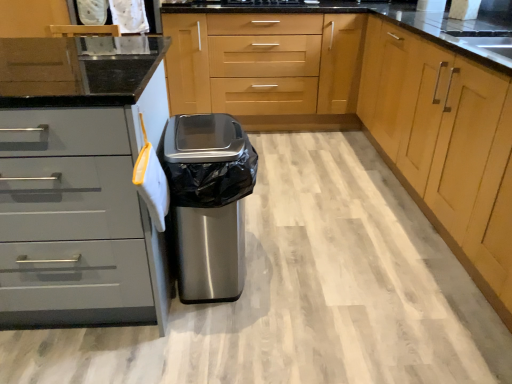
Question: From the image's perspective, would you say stainless steel trash can at center is shown under light wood cabinet at center, placed as the 4th cabinetry when sorted from left to right?

Choices:
 (A) no
 (B) yes

Answer: (B)

Question: Is stainless steel trash can at center shorter than light wood cabinet at center, placed as the 4th cabinetry when sorted from left to right?

Choices:
 (A) no
 (B) yes

Answer: (B)

Question: Does stainless steel trash can at center have a larger size compared to light wood cabinet at center, which appears as the first cabinetry when viewed from the right?

Choices:
 (A) yes
 (B) no

Answer: (B)

Question: Is stainless steel trash can at center far away from light wood cabinet at center, placed as the 4th cabinetry when sorted from left to right?

Choices:
 (A) yes
 (B) no

Answer: (B)

Question: Can you confirm if stainless steel trash can at center is wider than light wood cabinet at center, which appears as the first cabinetry when viewed from the right?

Choices:
 (A) yes
 (B) no

Answer: (B)

Question: Considering the relative positions of stainless steel trash can at center and light wood cabinet at center, which appears as the first cabinetry when viewed from the right, in the image provided, is stainless steel trash can at center to the right of light wood cabinet at center, which appears as the first cabinetry when viewed from the right, from the viewer's perspective?

Choices:
 (A) no
 (B) yes

Answer: (A)

Question: From the image's perspective, does light wood cabinet at center, which is the second cabinetry from left to right, appear higher than stainless steel trash can at center?

Choices:
 (A) no
 (B) yes

Answer: (B)

Question: Is light wood cabinet at center, the third cabinetry positioned from the right, turned away from stainless steel trash can at center?

Choices:
 (A) no
 (B) yes

Answer: (A)

Question: Is light wood cabinet at center, the third cabinetry positioned from the right, thinner than stainless steel trash can at center?

Choices:
 (A) yes
 (B) no

Answer: (B)

Question: Does light wood cabinet at center, the third cabinetry positioned from the right, lie behind stainless steel trash can at center?

Choices:
 (A) yes
 (B) no

Answer: (A)

Question: Can you confirm if light wood cabinet at center, which is the second cabinetry from left to right, is wider than stainless steel trash can at center?

Choices:
 (A) yes
 (B) no

Answer: (A)

Question: Does light wood cabinet at center, the third cabinetry positioned from the right, have a smaller size compared to stainless steel trash can at center?

Choices:
 (A) no
 (B) yes

Answer: (A)

Question: Does matte gray drawers at left, arranged as the first cabinetry when viewed from the left, have a lesser width compared to light wood cabinet at center, which appears as the first cabinetry when viewed from the right?

Choices:
 (A) no
 (B) yes

Answer: (A)